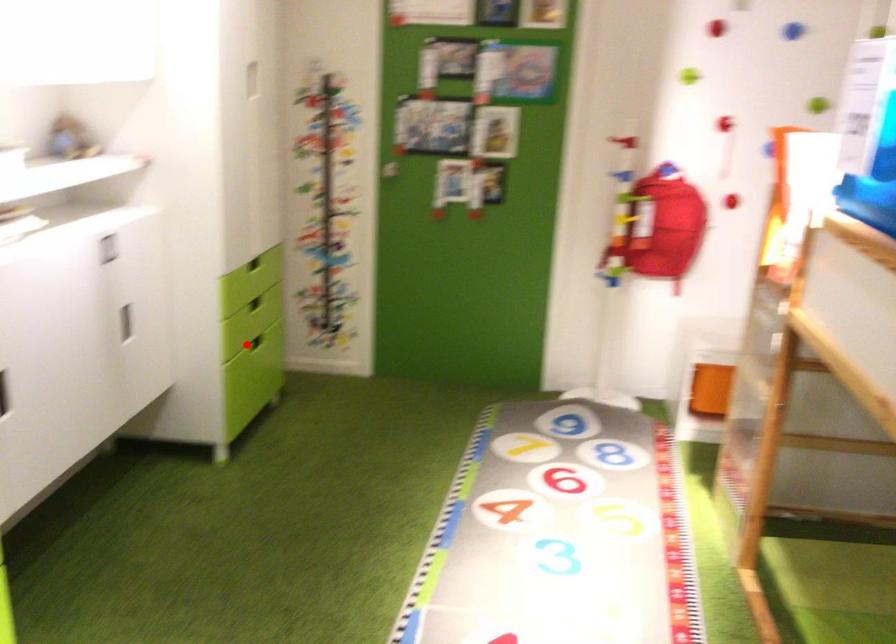
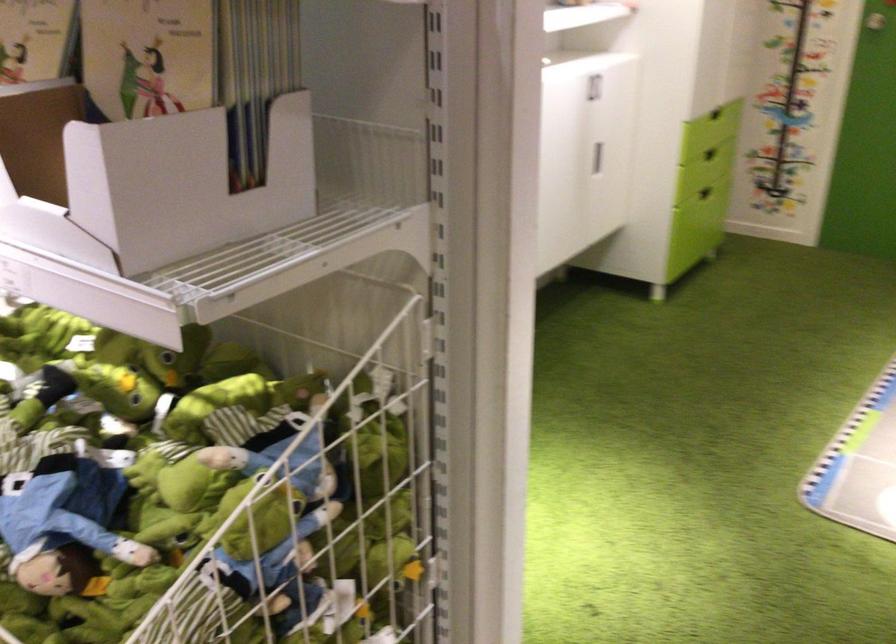
Find the pixel in the second image that matches the highlighted location in the first image.

(704, 193)